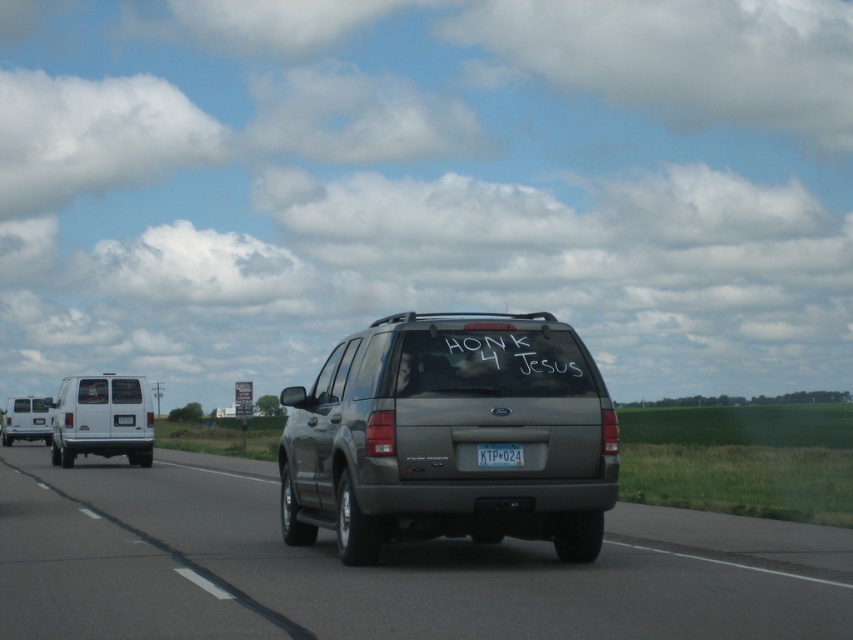
Question: Is matte gray suv at center below white plastic license plate at center?

Choices:
 (A) no
 (B) yes

Answer: (B)

Question: Can you confirm if satin gray suv at center is bigger than matte gray suv at center?

Choices:
 (A) no
 (B) yes

Answer: (B)

Question: Which point is closer to the camera?

Choices:
 (A) (115, 426)
 (B) (500, 449)

Answer: (B)

Question: Which object is the closest to the white matte van at left?

Choices:
 (A) matte gray suv at center
 (B) white plastic license plate at center

Answer: (B)

Question: Is white matte van at left positioned behind white plastic license plate at center?

Choices:
 (A) no
 (B) yes

Answer: (B)

Question: Which object is positioned closest to the white matte van at left?

Choices:
 (A) satin gray suv at center
 (B) matte gray suv at center
 (C) white plastic license plate at center

Answer: (A)